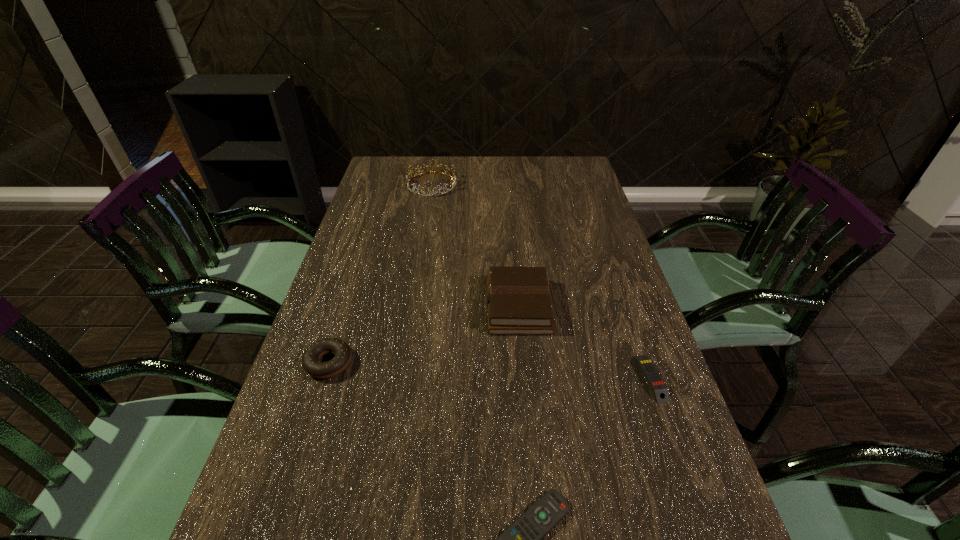
The image size is (960, 540). I want to click on the farthest object, so click(x=453, y=181).

This screenshot has width=960, height=540. Identify the location of the fourth object from right to left. (453, 181).

You are a GUI agent. You are given a task and a screenshot of the screen. Output one action in this format:
    pyautogui.click(x=<x>, y=<y>)
    Task: Click on the Bible
    This screenshot has width=960, height=540.
    Given the screenshot: What is the action you would take?
    pyautogui.click(x=518, y=299)

This screenshot has height=540, width=960. I want to click on the third shortest object, so click(x=310, y=361).

Locate an element on the screen. The height and width of the screenshot is (540, 960). the leftmost object is located at coordinates (310, 361).

Identify the location of the rightmost object. This screenshot has width=960, height=540. (657, 385).

Where is `the second shortest object`? the second shortest object is located at coordinates (657, 385).

Image resolution: width=960 pixels, height=540 pixels. I want to click on free region located on the front-facing side of the farthest object, so click(x=422, y=241).

Where is `vacant region located on the spine side of the fourth nearest object`? This screenshot has width=960, height=540. vacant region located on the spine side of the fourth nearest object is located at coordinates (362, 306).

This screenshot has height=540, width=960. I want to click on vacant space located on the spine side of the fourth nearest object, so click(x=396, y=306).